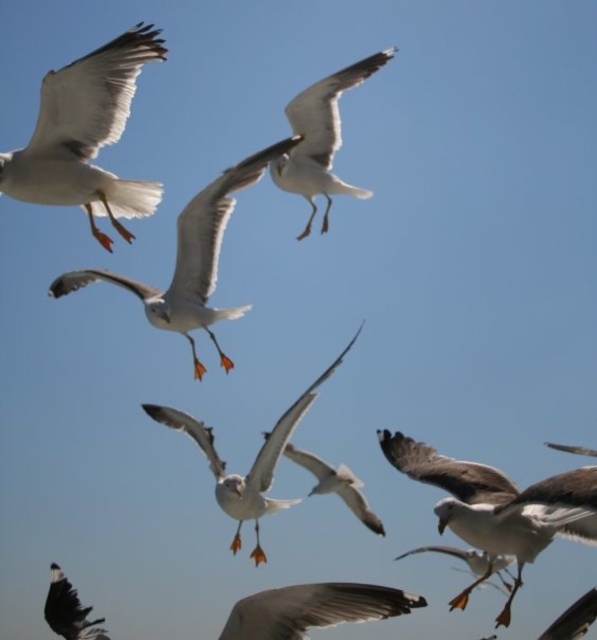
Looking at this image, can you confirm if white feathered seagull at lower center is positioned below white matte seagull at upper center?

Indeed, white feathered seagull at lower center is positioned under white matte seagull at upper center.

This screenshot has height=640, width=597. In order to click on white feathered seagull at lower center in this screenshot , I will do `click(312, 609)`.

Who is more distant from viewer, [309,602] or [318,83]?

The point [318,83] is behind.

The height and width of the screenshot is (640, 597). In order to click on white feathered seagull at lower center in this screenshot , I will do `click(312, 609)`.

Who is more distant from viewer, (72, 189) or (561, 532)?

The point (72, 189) is more distant.

Can you confirm if white matte seagull at upper left is positioned to the right of white feathered seagull at lower right?

Incorrect, white matte seagull at upper left is not on the right side of white feathered seagull at lower right.

Which is behind, point (35, 192) or point (537, 483)?

Point (35, 192)

Locate an element on the screen. This screenshot has height=640, width=597. white matte seagull at upper left is located at coordinates (85, 134).

In order to click on white matte seagull at upper left in this screenshot , I will do `click(85, 134)`.

Is point (127, 198) positioned behind point (315, 99)?

No, (127, 198) is in front of (315, 99).

Between point (100, 140) and point (304, 97), which one is positioned behind?

Positioned behind is point (304, 97).

I want to click on white matte seagull at upper left, so click(x=85, y=134).